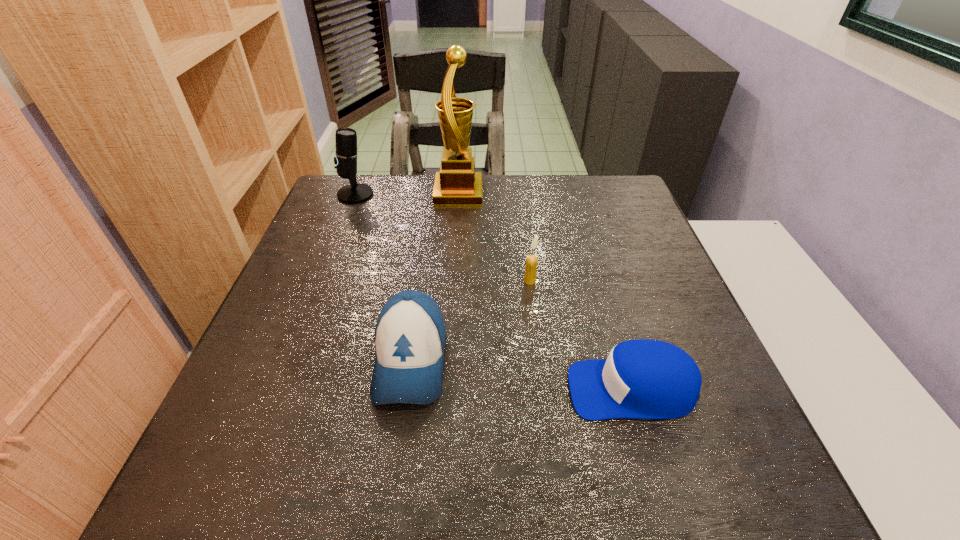
Find the location of a particular element. The width and height of the screenshot is (960, 540). free location located 0.240m on the right of the third nearest object is located at coordinates (639, 281).

Image resolution: width=960 pixels, height=540 pixels. What are the coordinates of `vacant region located on the front-facing side of the left baseball cap` in the screenshot? It's located at [395, 473].

This screenshot has width=960, height=540. Identify the location of free space located 0.110m on the front-facing side of the rightmost object. (508, 389).

At what (x,y) coordinates should I click in order to perform the action: click on vacant space located 0.110m on the front-facing side of the rightmost object. Please return your answer as a coordinate pair (x, y). Image resolution: width=960 pixels, height=540 pixels. Looking at the image, I should click on (508, 389).

In order to click on vacant area situated on the front-facing side of the rightmost object in this screenshot , I will do `click(503, 389)`.

Find the location of a particular element. award situated at the far edge is located at coordinates (457, 184).

The height and width of the screenshot is (540, 960). I want to click on microphone that is at the far edge, so click(x=346, y=153).

I want to click on object at the left edge, so click(346, 153).

At what (x,y) coordinates should I click in order to perform the action: click on object that is positioned at the right edge. Please return your answer as a coordinate pair (x, y). The width and height of the screenshot is (960, 540). Looking at the image, I should click on (643, 378).

Locate an element on the screen. The image size is (960, 540). object situated at the far left corner is located at coordinates (346, 153).